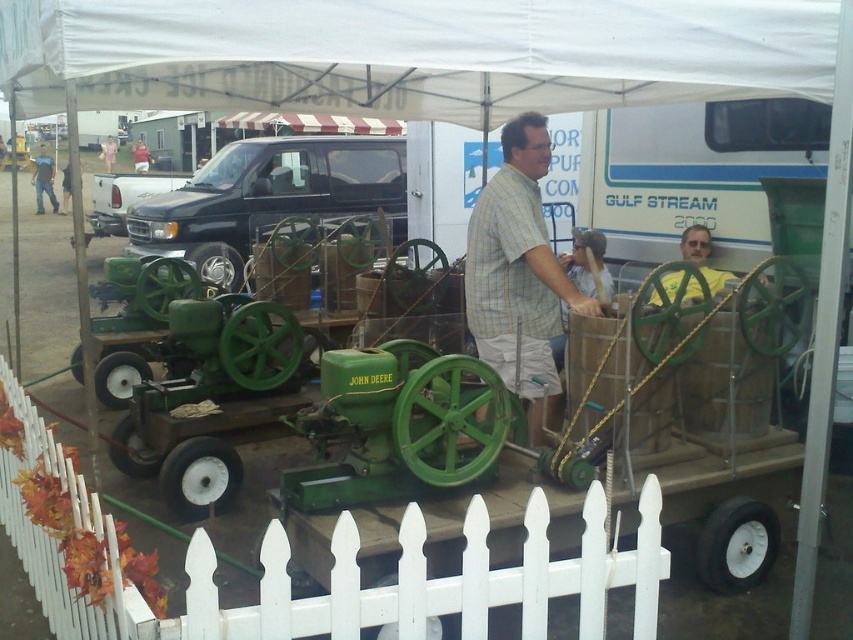
Question: Does yellow matte shirt at center come in front of brushed metal shirt at upper left?

Choices:
 (A) no
 (B) yes

Answer: (B)

Question: Observing the image, what is the correct spatial positioning of white picket fence at center in reference to yellow matte shirt at center?

Choices:
 (A) above
 (B) below

Answer: (B)

Question: Which object appears farthest from the camera in this image?

Choices:
 (A) yellow matte shirt at center
 (B) white picket fence at center

Answer: (A)

Question: Which is nearer to the brushed metal shirt at upper left?

Choices:
 (A) yellow matte shirt at center
 (B) checkered fabric shirt at center

Answer: (A)

Question: Among these points, which one is farthest from the camera?

Choices:
 (A) (91, 502)
 (B) (554, 372)
 (C) (701, 269)
 (D) (44, 186)

Answer: (D)

Question: Is yellow matte shirt at center thinner than brushed metal shirt at upper left?

Choices:
 (A) no
 (B) yes

Answer: (A)